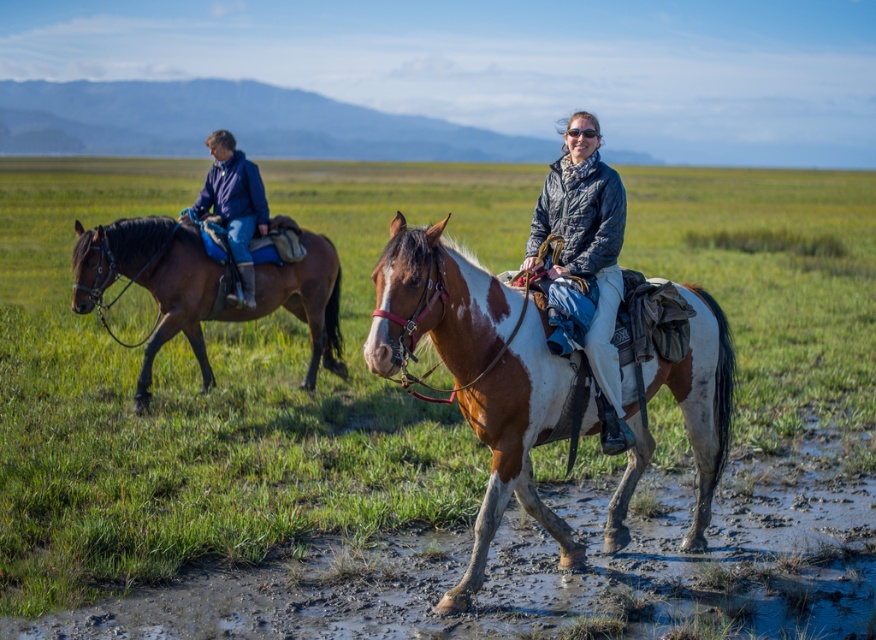
Question: Considering the real-world distances, which object is closest to the brown leather horse at left?

Choices:
 (A) green grass at center
 (B) brown speckled horse at center

Answer: (B)

Question: Which of the following is the closest to the observer?

Choices:
 (A) (591, 332)
 (B) (704, 305)
 (C) (193, 211)

Answer: (A)

Question: Is brown speckled horse at center positioned at the back of matte gray jacket at center?

Choices:
 (A) no
 (B) yes

Answer: (A)

Question: Can you confirm if brown speckled horse at center is positioned to the left of brown leather horse at left?

Choices:
 (A) no
 (B) yes

Answer: (A)

Question: Does matte gray jacket at center appear on the right side of blue denim jacket at upper left?

Choices:
 (A) no
 (B) yes

Answer: (B)

Question: Which point is farther to the camera?

Choices:
 (A) brown leather horse at left
 (B) brown speckled horse at center
 (C) blue denim jacket at upper left
 (D) green grass at center

Answer: (C)